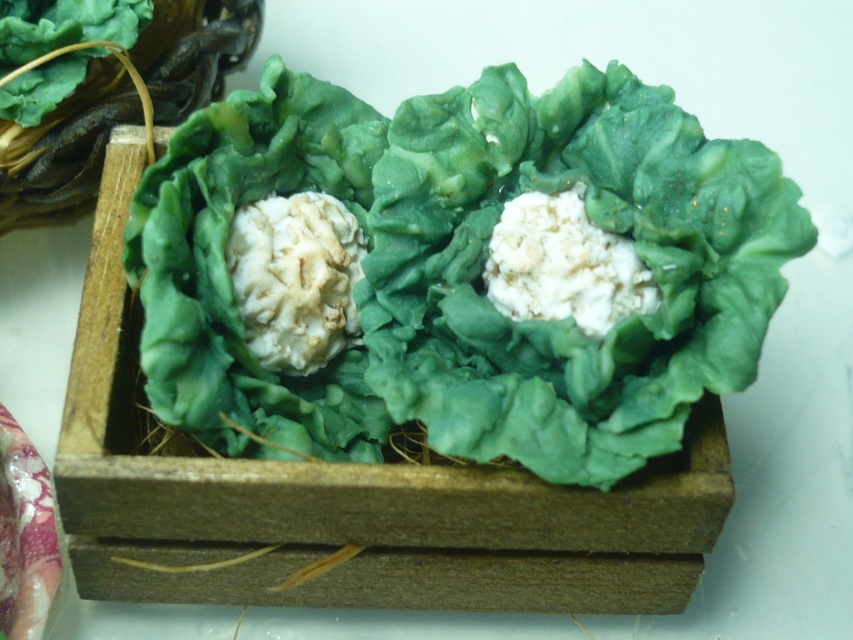
You are arranging items in a wooden crate and need to place the green matte lettuce at center and white crumbly food at center. According to the image, which one is on the left side?

The white crumbly food at center is on the left side because the green matte lettuce at center is positioned on the right side of it.

You are a grocery store employee who needs to arrange these items in a display. Since the green matte lettuce at center and the white crumbly food at center are both at the center of the crate, which one should you place first to ensure the smaller item is visible?

Since the green matte lettuce at center is bigger than the white crumbly food at center, you should place the white crumbly food at center first so that the smaller item remains visible on top.

You are examining the wooden crate and want to know which of the two points, point (474,161) or point (310,230), is closer to you. Can you determine this?

Point (474,161) is further to the camera than point (310,230), so the closer point to you is point (310,230).